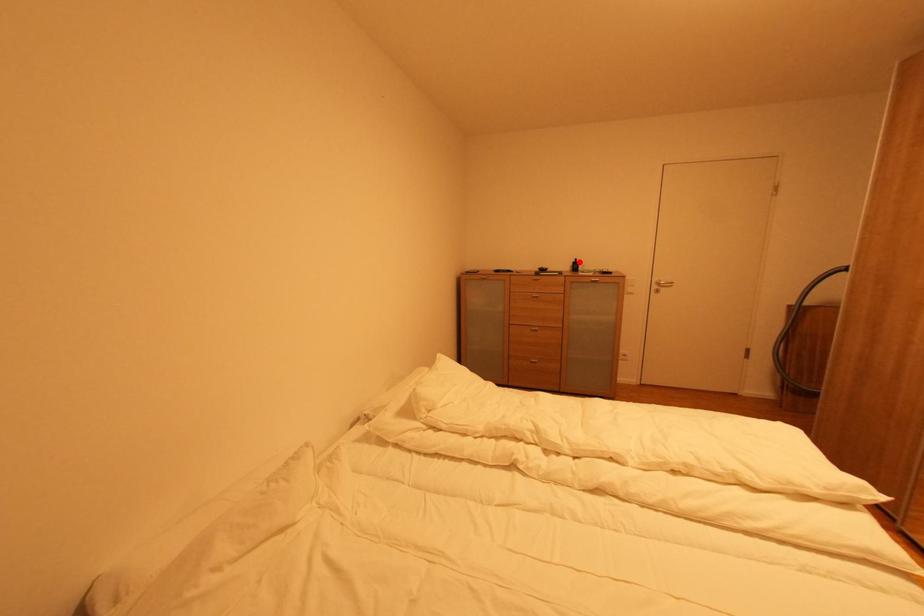
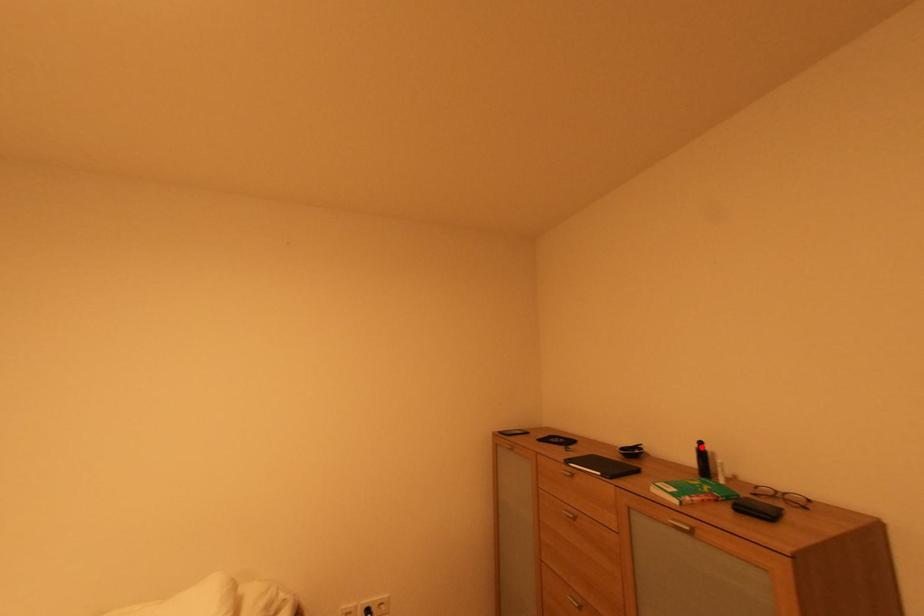
I am providing you with two images of the same scene from different viewpoints. A red point is marked on the first image and another point is marked on the second image. Is the marked point in image1 the same physical position as the marked point in image2?

Yes